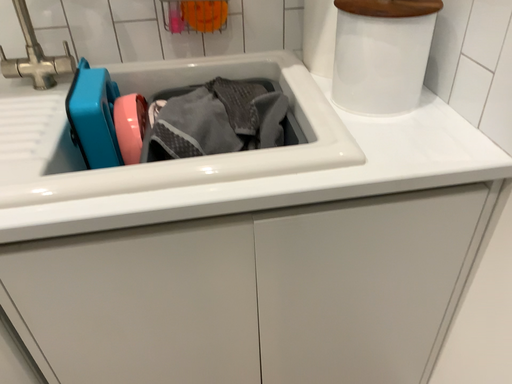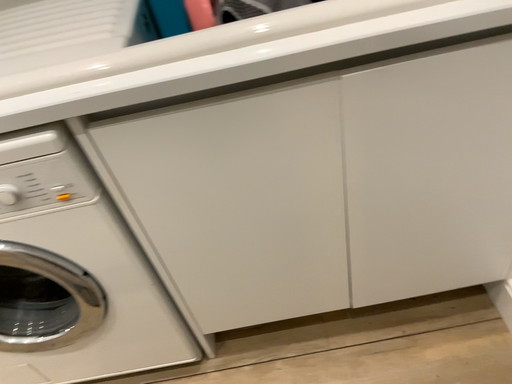
Question: How did the camera likely rotate when shooting the video?

Choices:
 (A) rotated left
 (B) rotated right

Answer: (A)